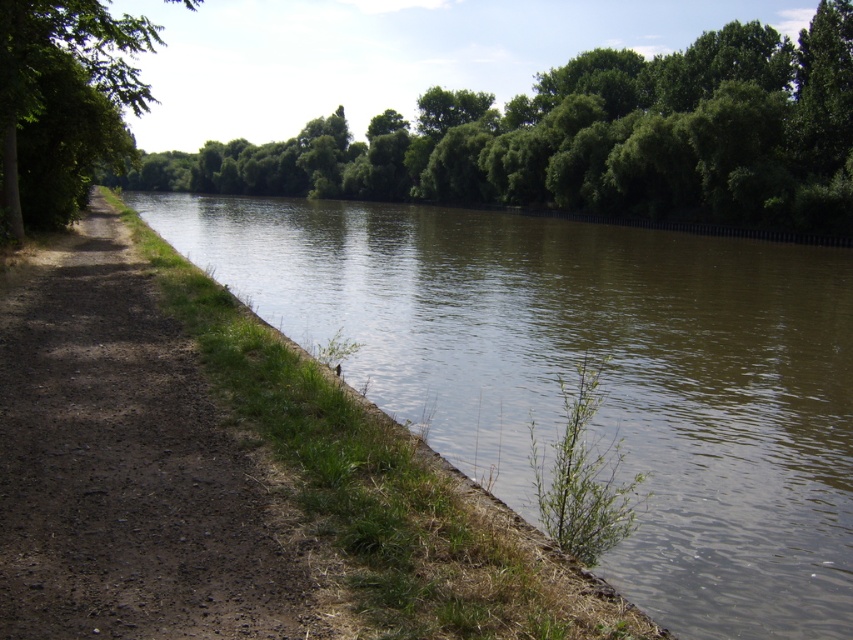
You are a hiker who wants to cross the river using a bridge that is 80 feet long. The green grassy river at left and the green leafy tree at left are both in your line of sight. Can you safely cross the river using the bridge without it being too short?

The green grassy river at left is 78.93 feet from the green leafy tree at left. Since the bridge is 80 feet long, it is slightly longer than the distance, so it should be safe to cross the river using the bridge without it being too short.

You are standing on the dirt path and want to cross the river. The green grassy river at left is the closest point. Can you safely cross it if your maximum safe crossing distance is 20 feet?

The green grassy river at left is 19.27 feet away from the viewer, which is within the safe distance of 20 feet. Therefore, you can safely cross it.

You are a hiker standing on the brown dirt path at left and want to cross to the dense trees on the far side of the green grassy river at left. Which direction should you walk along the path to find a bridge?

The green grassy river at left is further to the viewer than the brown dirt path at left, so the path is closer to you. To find a bridge, walk along the brown dirt path at left in the direction away from the river since the path is closer to you and the bridge would be upstream or downstream where the path continues.